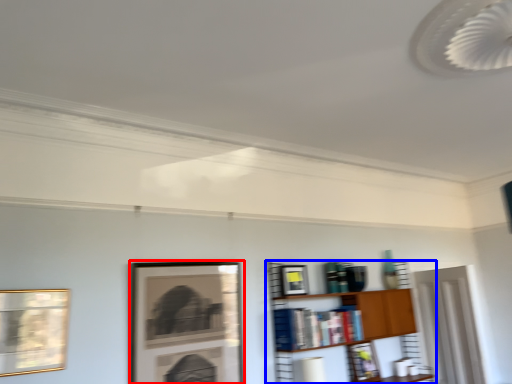
Question: Which object appears farthest to the camera in this image, picture frame (highlighted by a red box) or shelf (highlighted by a blue box)?

Choices:
 (A) picture frame
 (B) shelf

Answer: (B)